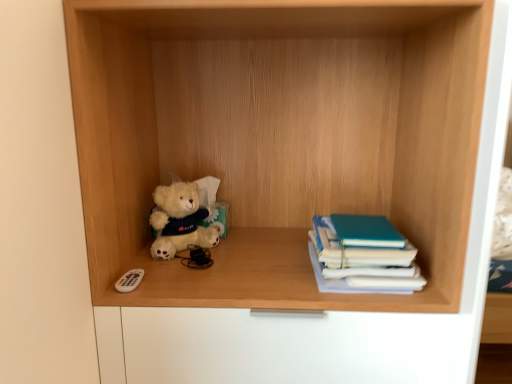
Question: Does white plastic remote control at lower left touch fluffy white teddy bear at center-left?

Choices:
 (A) no
 (B) yes

Answer: (A)

Question: Is white plastic remote control at lower left taller than fluffy white teddy bear at center-left?

Choices:
 (A) yes
 (B) no

Answer: (B)

Question: From a real-world perspective, is white plastic remote control at lower left below fluffy white teddy bear at center-left?

Choices:
 (A) yes
 (B) no

Answer: (A)

Question: Considering the relative positions of white plastic remote control at lower left and fluffy white teddy bear at center-left in the image provided, is white plastic remote control at lower left to the right of fluffy white teddy bear at center-left from the viewer's perspective?

Choices:
 (A) yes
 (B) no

Answer: (B)

Question: Is white plastic remote control at lower left positioned beyond the bounds of fluffy white teddy bear at center-left?

Choices:
 (A) yes
 (B) no

Answer: (A)

Question: Considering the positions of point (157, 210) and point (407, 120), is point (157, 210) closer or farther from the camera than point (407, 120)?

Choices:
 (A) farther
 (B) closer

Answer: (B)

Question: From a real-world perspective, is fluffy white teddy bear at center-left above or below wooden shelf at center?

Choices:
 (A) above
 (B) below

Answer: (B)

Question: Relative to wooden shelf at center, is fluffy white teddy bear at center-left in front or behind?

Choices:
 (A) behind
 (B) front

Answer: (A)

Question: Which is correct: fluffy white teddy bear at center-left is inside wooden shelf at center, or outside of it?

Choices:
 (A) inside
 (B) outside

Answer: (A)

Question: From a real-world perspective, is wooden shelf at center positioned above or below white plastic remote control at lower left?

Choices:
 (A) below
 (B) above

Answer: (B)

Question: Relative to white plastic remote control at lower left, is wooden shelf at center in front or behind?

Choices:
 (A) front
 (B) behind

Answer: (A)

Question: Choose the correct answer: Is wooden shelf at center inside white plastic remote control at lower left or outside it?

Choices:
 (A) outside
 (B) inside

Answer: (A)

Question: From the image's perspective, relative to white plastic remote control at lower left, is wooden shelf at center above or below?

Choices:
 (A) below
 (B) above

Answer: (B)

Question: From a real-world perspective, is fluffy white teddy bear at center-left above or below white plastic remote control at lower left?

Choices:
 (A) above
 (B) below

Answer: (A)

Question: Considering the positions of point (198, 203) and point (132, 284), is point (198, 203) closer or farther from the camera than point (132, 284)?

Choices:
 (A) farther
 (B) closer

Answer: (A)